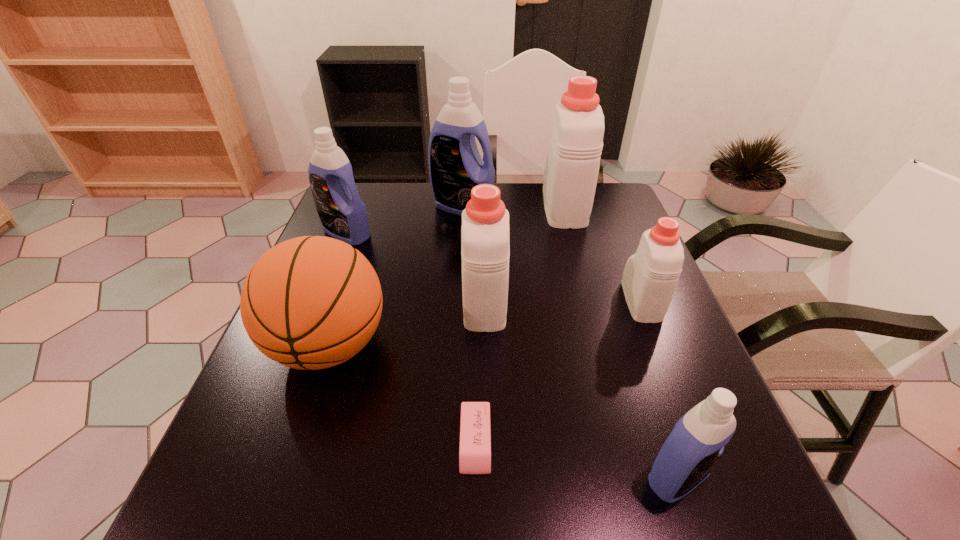
I want to click on blue detergent object that ranks as the closest to the biggest blue detergent, so click(343, 215).

Choose which blue detergent is the second nearest neighbor to the shortest object. Please provide its 2D coordinates. Your answer should be formatted as a tuple, i.e. [(x, y)], where the tuple contains the x and y coordinates of a point satisfying the conditions above.

[(343, 215)]

The height and width of the screenshot is (540, 960). Identify the location of free location that satisfies the following two spatial constraints: 1. on the front side of the pink eraser; 2. on the right side of the orange basketball. (297, 442).

This screenshot has height=540, width=960. Find the location of `vacant region that satisfies the following two spatial constraints: 1. on the front side of the basketball; 2. on the left side of the leftmost blue detergent`. vacant region that satisfies the following two spatial constraints: 1. on the front side of the basketball; 2. on the left side of the leftmost blue detergent is located at coordinates (302, 346).